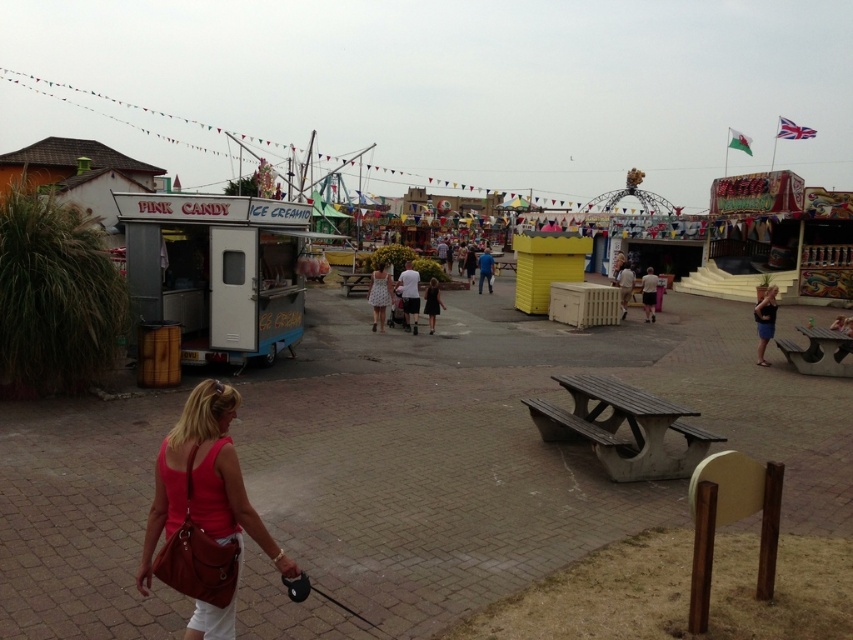
You are a person who wants to sit at the wooden picnic table at center while wearing the blue fabric shirt at center. Can you comfortably sit there without the shirt getting caught on the table?

The wooden picnic table at center is shorter than the blue fabric shirt at center, so there is a risk that the shirt might get caught on the table when sitting down.